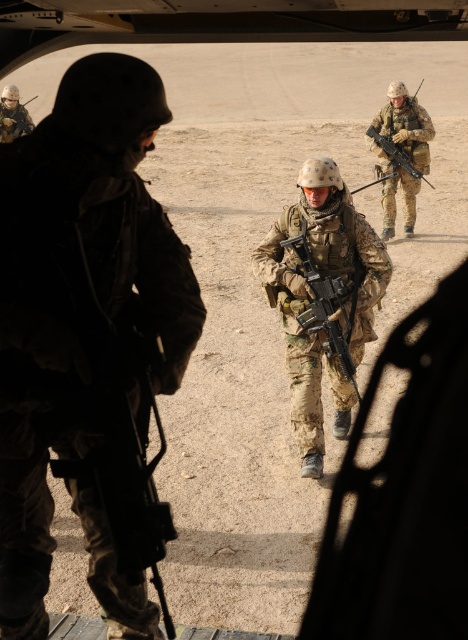
You are a drone operator tasked with identifying the position of the camouflage fabric rifle at center in the LZ. According to the coordinates provided, where exactly is the rifle positioned?

The camouflage fabric rifle at center is located at point 0.241 on the x axis and 0.855 on the y axis.

You are observing two soldiers in the midground of the LZ scene. Both are wearing camouflage uniforms. According to their positions, which soldier, the camouflage uniform at center or the camouflage fabric uniform at center, is shorter in height?

The camouflage uniform at center is not as tall as the camouflage fabric uniform at center, so the camouflage uniform at center is shorter in height.